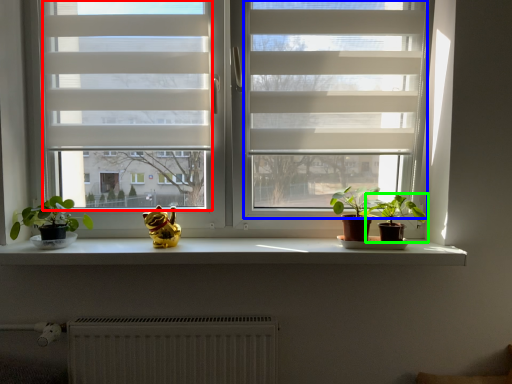
Question: Considering the real-world distances, which object is farthest from window screen (highlighted by a red box)? screen door (highlighted by a blue box) or houseplant (highlighted by a green box)?

Choices:
 (A) screen door
 (B) houseplant

Answer: (B)